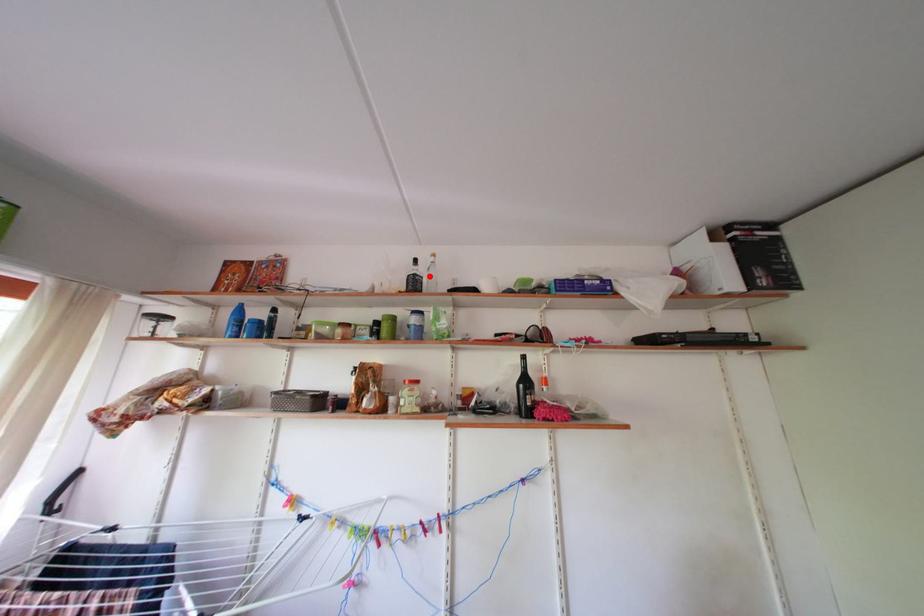
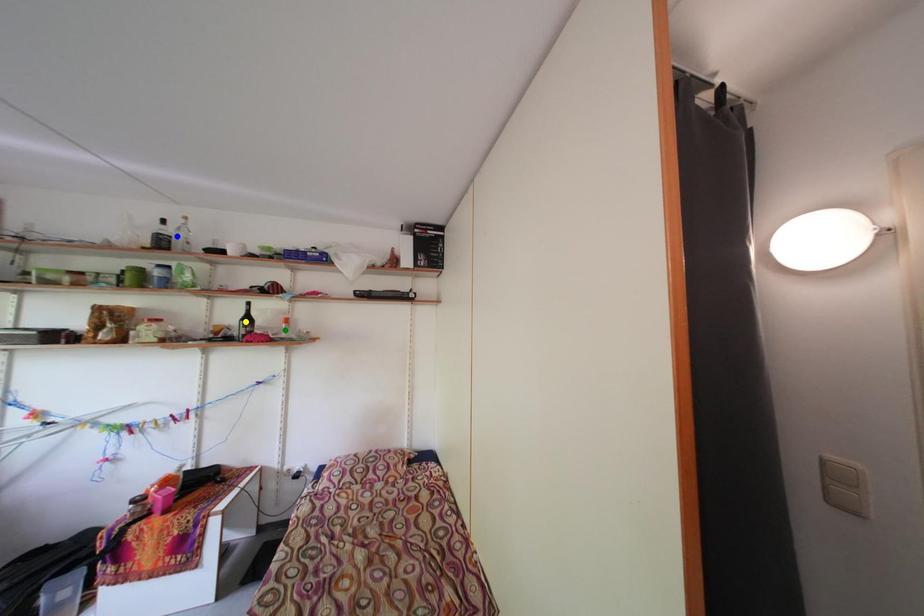
Question: I am providing you with two images of the same scene from different viewpoints. A red point is marked on the first image. You are given multiple points on the second image. In image 2, which mark is for the same physical point as the one in image 1?

Choices:
 (A) green point
 (B) blue point
 (C) yellow point

Answer: (B)